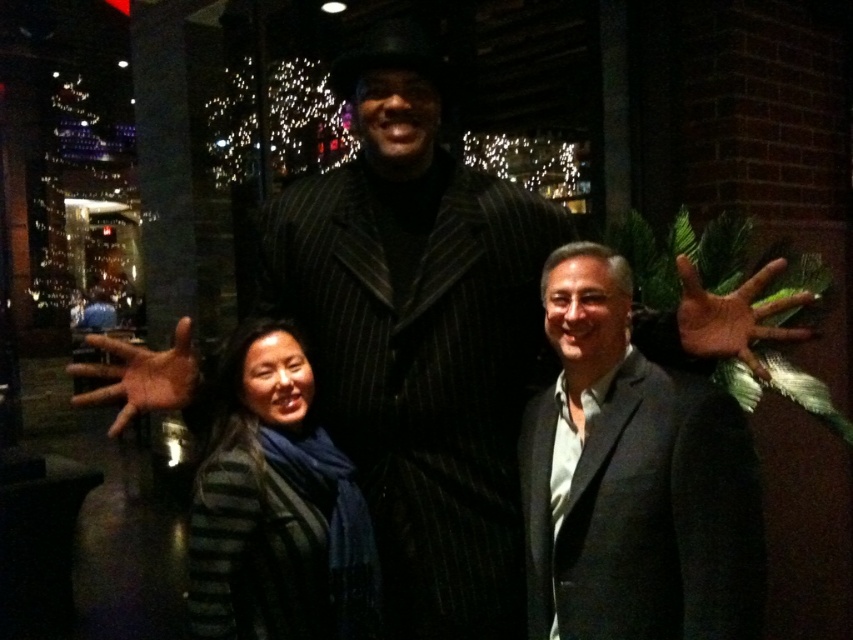
Question: Which object is the farthest from the brown leather hand at center?

Choices:
 (A) striped sweater at center
 (B) brown leather hand at lower left

Answer: (B)

Question: Which point is farther from the camera taking this photo?

Choices:
 (A) (160, 371)
 (B) (773, 276)
 (C) (248, 476)
 (D) (718, 412)

Answer: (A)

Question: Observing the image, what is the correct spatial positioning of matte black suit at center in reference to brown leather hand at center?

Choices:
 (A) above
 (B) below

Answer: (B)

Question: Does matte black suit at center appear on the right side of striped sweater at center?

Choices:
 (A) yes
 (B) no

Answer: (A)

Question: Is striped sweater at center to the right of brown leather hand at center from the viewer's perspective?

Choices:
 (A) no
 (B) yes

Answer: (A)

Question: Which object is farther from the camera taking this photo?

Choices:
 (A) brown leather hand at lower left
 (B) brown leather hand at center

Answer: (A)